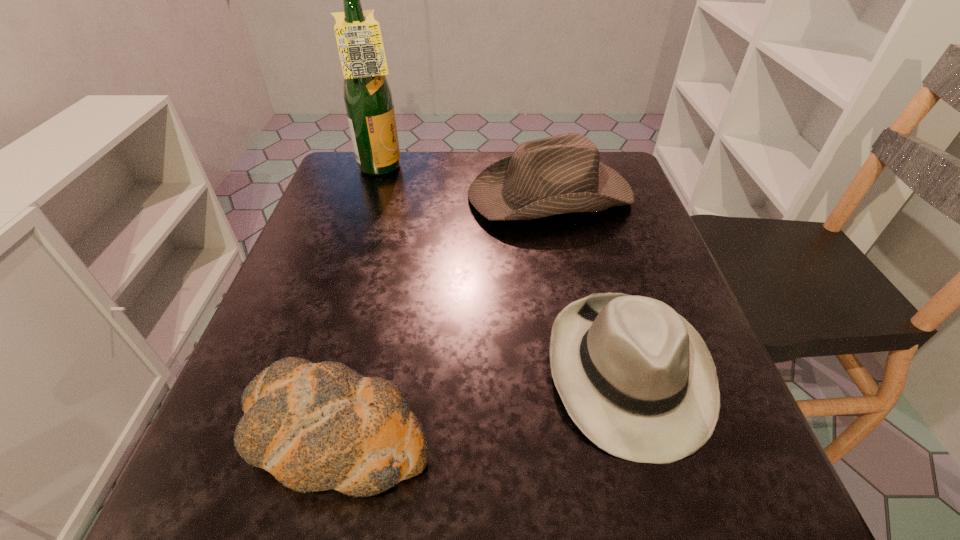
Where is `fedora that is at the far edge`? This screenshot has width=960, height=540. fedora that is at the far edge is located at coordinates (561, 174).

I want to click on fedora at the near edge, so click(x=637, y=379).

Find the location of a particular element. bread that is at the near edge is located at coordinates (314, 426).

The height and width of the screenshot is (540, 960). Find the location of `liquor located in the left edge section of the desktop`. liquor located in the left edge section of the desktop is located at coordinates (368, 99).

Find the location of a particular element. Image resolution: width=960 pixels, height=540 pixels. bread that is at the left edge is located at coordinates (314, 426).

Where is `object located at the far left corner`? object located at the far left corner is located at coordinates (368, 99).

This screenshot has height=540, width=960. I want to click on object at the near left corner, so click(314, 426).

Identify the location of object that is at the far right corner. (561, 174).

The height and width of the screenshot is (540, 960). What are the coordinates of `object located in the near right corner section of the desktop` in the screenshot? It's located at (637, 379).

The image size is (960, 540). In the image, there is a desktop. Identify the location of vacant space at the far edge. (448, 197).